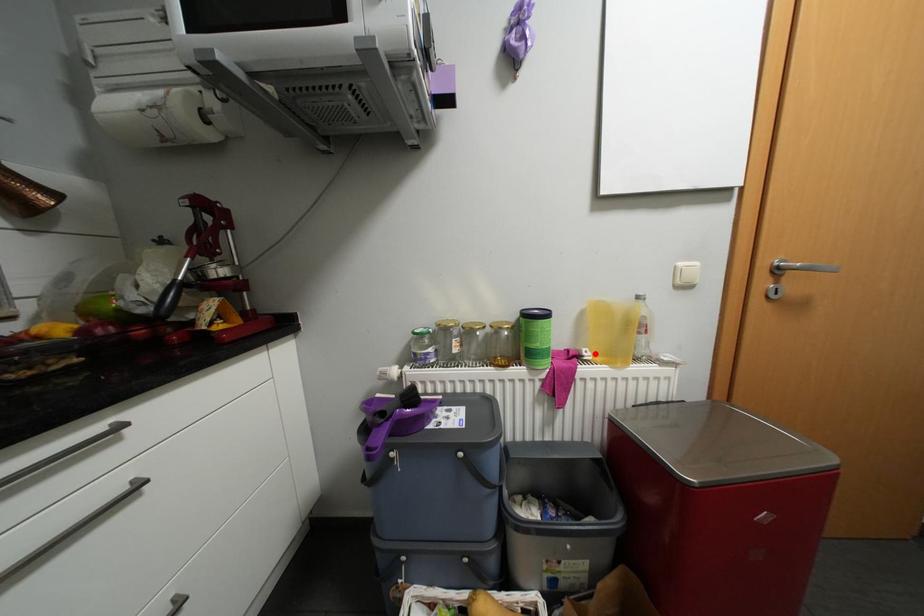
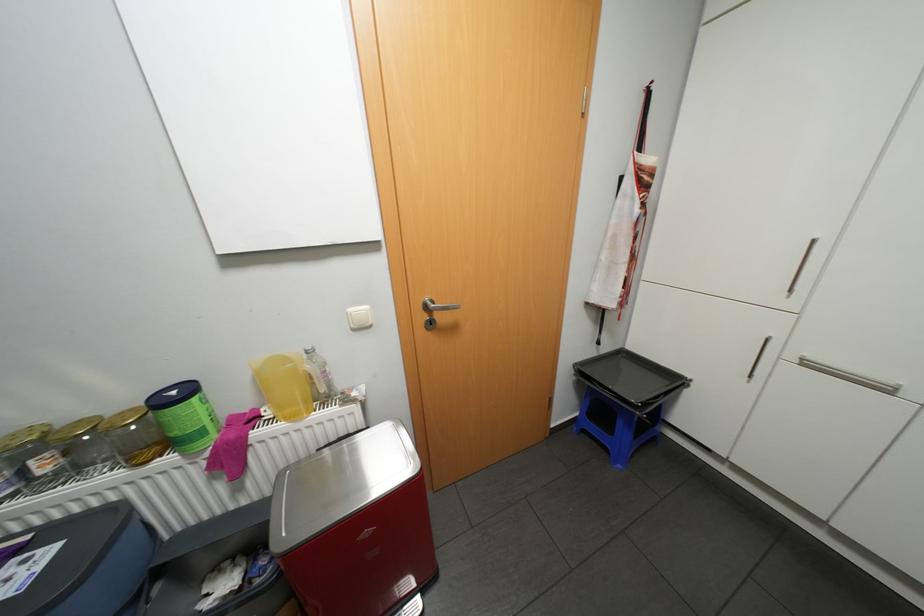
In the second image, find the point that corresponds to the highlighted location in the first image.

(275, 413)